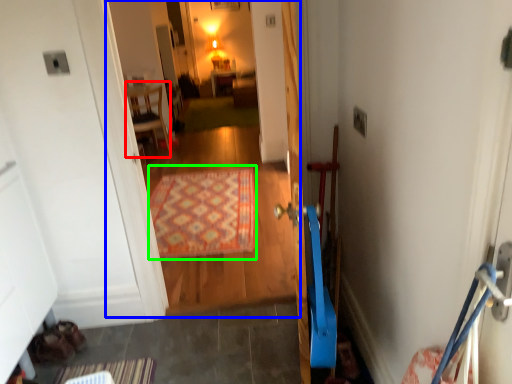
Question: Which object is the closest to the furniture (highlighted by a red box)? Choose among these: corridor (highlighted by a blue box) or doormat (highlighted by a green box).

Choices:
 (A) corridor
 (B) doormat

Answer: (A)